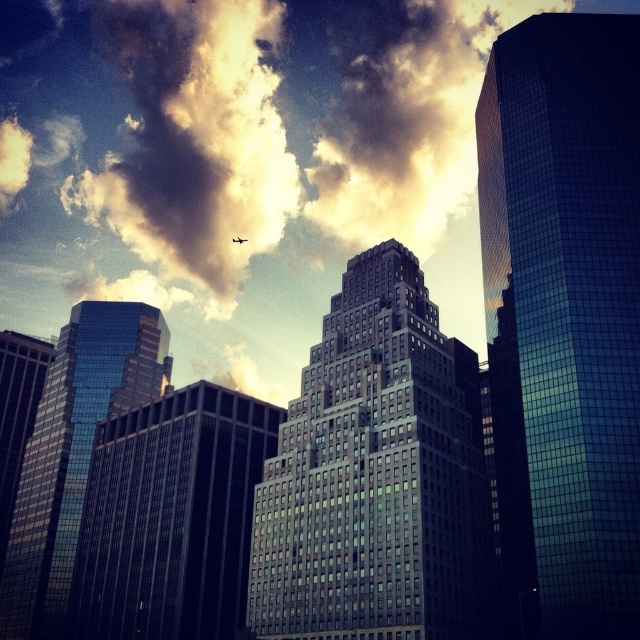
Question: Which of the following is the closest to the observer?

Choices:
 (A) (237, 236)
 (B) (122, 582)
 (C) (532, 51)

Answer: (C)

Question: Does matte glass building at center lie behind black matte airplane at upper center?

Choices:
 (A) no
 (B) yes

Answer: (A)

Question: Considering the real-world distances, which object is closest to the black matte airplane at upper center?

Choices:
 (A) glassy skyscraper at center
 (B) glossy glass skyscraper at upper right

Answer: (A)

Question: Can you confirm if glossy glass skyscraper at upper right is positioned to the left of cloudy sky at upper center?

Choices:
 (A) no
 (B) yes

Answer: (A)

Question: Does matte glass building at center have a larger size compared to cloudy sky at upper center?

Choices:
 (A) yes
 (B) no

Answer: (B)

Question: Which object appears closest to the camera in this image?

Choices:
 (A) cloudy sky at upper center
 (B) glossy glass skyscraper at upper right
 (C) glassy skyscraper at center

Answer: (B)